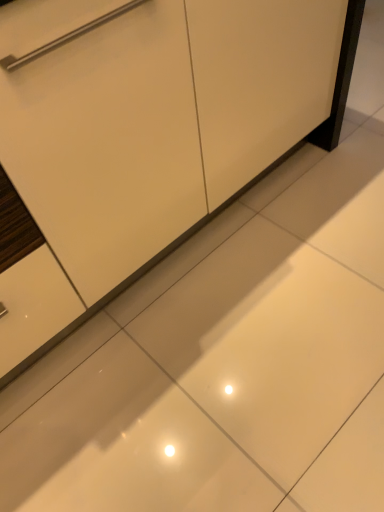
This screenshot has width=384, height=512. What do you see at coordinates (241, 188) in the screenshot?
I see `matte white cabinet at center` at bounding box center [241, 188].

What is the approximate width of matte white cabinet at center?

36.90 inches.

Identify the location of matte white cabinet at center. (241, 188).

You are a GUI agent. You are given a task and a screenshot of the screen. Output one action in this format:
    pyautogui.click(x=<x>, y=<y>)
    Task: Click on the matte white cabinet at center
    The height and width of the screenshot is (512, 384).
    Given the screenshot: What is the action you would take?
    pyautogui.click(x=241, y=188)